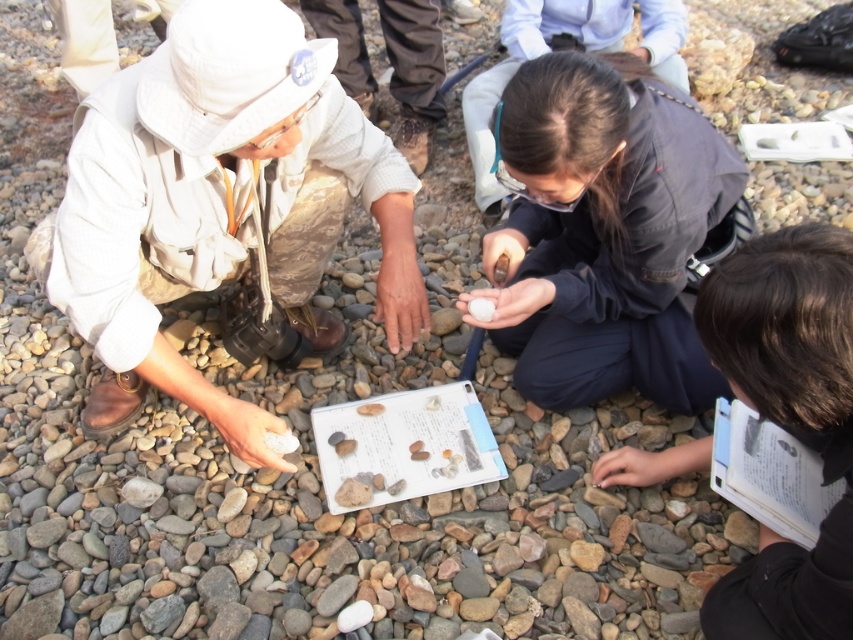
Looking at this image, who is more forward, (80, 170) or (659, 337)?

Point (80, 170) is in front.

Between matte beige hat at upper left and dark blue fabric at center, which one is positioned lower?

matte beige hat at upper left is below.

Does point (136, 224) come in front of point (540, 400)?

That is True.

The image size is (853, 640). I want to click on matte beige hat at upper left, so click(219, 204).

How far apart are matte beige hat at upper left and black matte book at lower right?

They are 38.19 inches apart.

Between matte beige hat at upper left and black matte book at lower right, which one is positioned lower?

Positioned lower is black matte book at lower right.

What do you see at coordinates (219, 204) in the screenshot? I see `matte beige hat at upper left` at bounding box center [219, 204].

Find the location of a particular element. matte beige hat at upper left is located at coordinates (219, 204).

Looking at this image, is dark blue fabric at center taller than black matte book at lower right?

Indeed, dark blue fabric at center has a greater height compared to black matte book at lower right.

Which is more to the right, dark blue fabric at center or black matte book at lower right?

black matte book at lower right is more to the right.

Between point (601, 308) and point (728, 323), which one is positioned in front?

Point (728, 323) is more forward.

In order to click on dark blue fabric at center in this screenshot , I will do `click(606, 232)`.